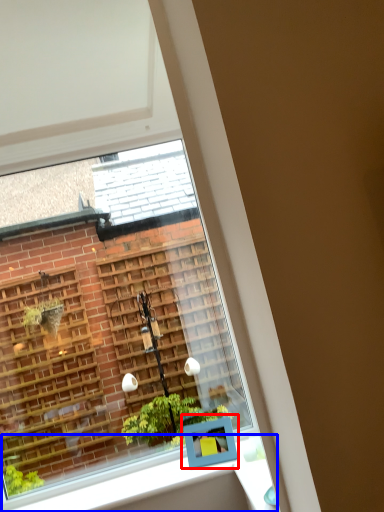
Question: Which object is further to the camera taking this photo, window box (highlighted by a red box) or window sill (highlighted by a blue box)?

Choices:
 (A) window box
 (B) window sill

Answer: (A)